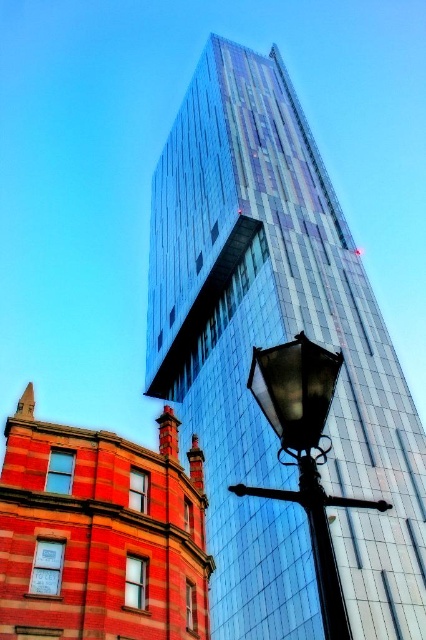
You are a city planner analyzing the image. You need to determine if the shiny glass skyscraper at center can accommodate a new black glass street light at lower right in terms of width. Based on the scene, can the skyscraper fit the street light in its width?

The shiny glass skyscraper at center is wider than the black glass street light at lower right, so yes, the skyscraper can accommodate the street light in terms of width.

You are standing at the entrance of the traditional red brick building on the left. You want to take a photo of the shiny glass skyscraper at center. Which direction should you face to capture it in your camera?

Since the shiny glass skyscraper at center is located at coordinates approximately 0.537 along the horizontal axis and 0.646 along the vertical axis, you should face towards the right direction from the traditional red brick building on the left to capture it in your photo.